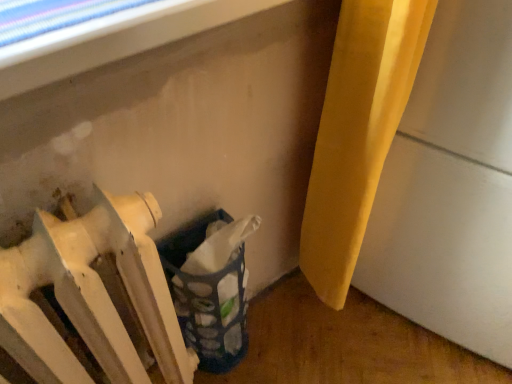
The image size is (512, 384). What are the coordinates of `blue fabric laundry basket at lower center` in the screenshot? It's located at (208, 298).

This screenshot has width=512, height=384. What do you see at coordinates (208, 298) in the screenshot?
I see `blue fabric laundry basket at lower center` at bounding box center [208, 298].

What is the approximate height of blue fabric laundry basket at lower center?

It is 49.96 centimeters.

Describe the element at coordinates (91, 295) in the screenshot. This screenshot has width=512, height=384. I see `white matte radiator at lower left` at that location.

Find the location of `white matte radiator at lower left`. white matte radiator at lower left is located at coordinates (91, 295).

Find the location of a particular element. blue fabric laundry basket at lower center is located at coordinates (208, 298).

Can you confirm if white matte radiator at lower left is positioned to the right of blue fabric laundry basket at lower center?

No, white matte radiator at lower left is not to the right of blue fabric laundry basket at lower center.

Does white matte radiator at lower left come in front of blue fabric laundry basket at lower center?

Yes, it is.

Which is further, (169, 313) or (234, 268)?

Point (234, 268)

From the image's perspective, is white matte radiator at lower left above blue fabric laundry basket at lower center?

Actually, white matte radiator at lower left appears below blue fabric laundry basket at lower center in the image.

From a real-world perspective, is white matte radiator at lower left physically located above or below blue fabric laundry basket at lower center?

white matte radiator at lower left is above blue fabric laundry basket at lower center.

Between white matte radiator at lower left and blue fabric laundry basket at lower center, which one has smaller width?

Thinner between the two is blue fabric laundry basket at lower center.

Considering the relative sizes of white matte radiator at lower left and blue fabric laundry basket at lower center in the image provided, is white matte radiator at lower left taller than blue fabric laundry basket at lower center?

Yes, white matte radiator at lower left is taller than blue fabric laundry basket at lower center.

Between white matte radiator at lower left and blue fabric laundry basket at lower center, which one has larger size?

With larger size is white matte radiator at lower left.

Is white matte radiator at lower left inside or outside of blue fabric laundry basket at lower center?

white matte radiator at lower left lies outside blue fabric laundry basket at lower center.

In the scene shown: Is white matte radiator at lower left not close to blue fabric laundry basket at lower center?

white matte radiator at lower left is near blue fabric laundry basket at lower center, not far away.

Could you tell me if white matte radiator at lower left is facing blue fabric laundry basket at lower center?

No, white matte radiator at lower left is not oriented towards blue fabric laundry basket at lower center.

Looking at this image, how different are the orientations of white matte radiator at lower left and blue fabric laundry basket at lower center in degrees?

white matte radiator at lower left and blue fabric laundry basket at lower center are facing 2.21 degrees away from each other.

How much distance is there between white matte radiator at lower left and blue fabric laundry basket at lower center?

A distance of 8.03 inches exists between white matte radiator at lower left and blue fabric laundry basket at lower center.

Locate an element on the screen. The image size is (512, 384). laundry basket behind the white matte radiator at lower left is located at coordinates (208, 298).

Which is more to the left, blue fabric laundry basket at lower center or white matte radiator at lower left?

From the viewer's perspective, white matte radiator at lower left appears more on the left side.

Does blue fabric laundry basket at lower center come in front of white matte radiator at lower left?

No, it is behind white matte radiator at lower left.

Is point (175, 243) closer or farther from the camera than point (134, 308)?

Point (175, 243) is farther from the camera than point (134, 308).

From the image's perspective, which is below, blue fabric laundry basket at lower center or white matte radiator at lower left?

white matte radiator at lower left.

In the scene shown: From a real-world perspective, is blue fabric laundry basket at lower center on white matte radiator at lower left?

No, from a real-world perspective, blue fabric laundry basket at lower center is not over white matte radiator at lower left

Considering the sizes of blue fabric laundry basket at lower center and white matte radiator at lower left in the image, is blue fabric laundry basket at lower center wider or thinner than white matte radiator at lower left?

Clearly, blue fabric laundry basket at lower center has less width compared to white matte radiator at lower left.

Which of these two, blue fabric laundry basket at lower center or white matte radiator at lower left, stands taller?

With more height is white matte radiator at lower left.

Does blue fabric laundry basket at lower center have a smaller size compared to white matte radiator at lower left?

Yes.

Is blue fabric laundry basket at lower center inside or outside of white matte radiator at lower left?

blue fabric laundry basket at lower center is not enclosed by white matte radiator at lower left.

Is blue fabric laundry basket at lower center not close to white matte radiator at lower left?

No.

Is blue fabric laundry basket at lower center aimed at white matte radiator at lower left?

No, blue fabric laundry basket at lower center is not facing towards white matte radiator at lower left.

How much distance is there between blue fabric laundry basket at lower center and white matte radiator at lower left?

A distance of 8.03 inches exists between blue fabric laundry basket at lower center and white matte radiator at lower left.

Locate an element on the screen. radiator located above the blue fabric laundry basket at lower center (from a real-world perspective) is located at coordinates (91, 295).

Find the location of a particular element. The image size is (512, 384). laundry basket above the white matte radiator at lower left (from the image's perspective) is located at coordinates (208, 298).

Identify the location of laundry basket behind the white matte radiator at lower left. (208, 298).